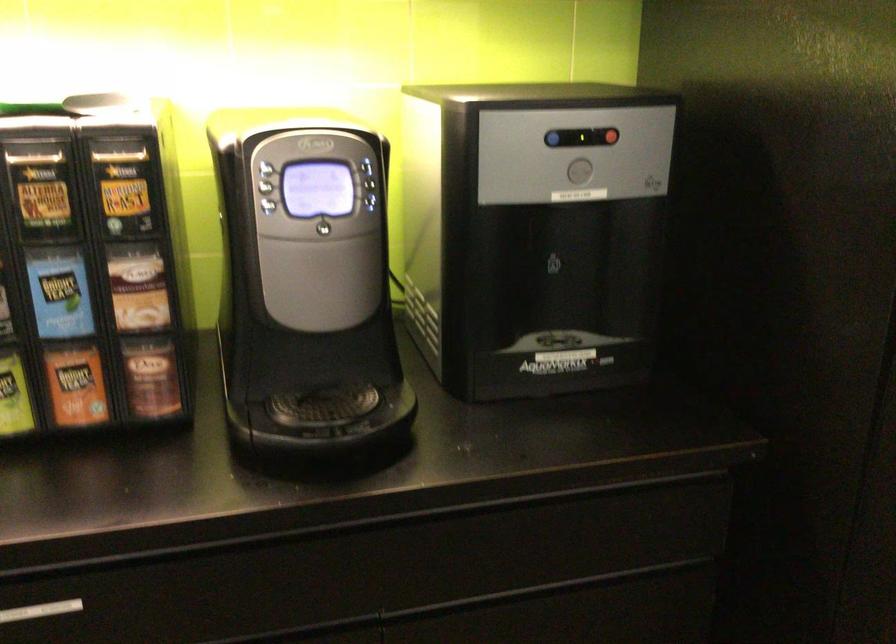
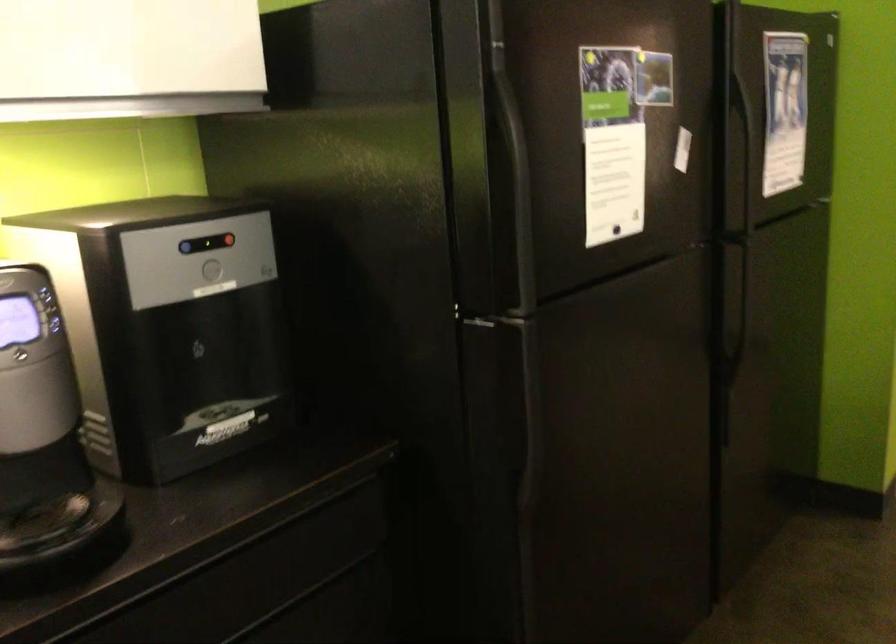
The point at (556, 134) is marked in the first image. Where is the corresponding point in the second image?

(186, 247)